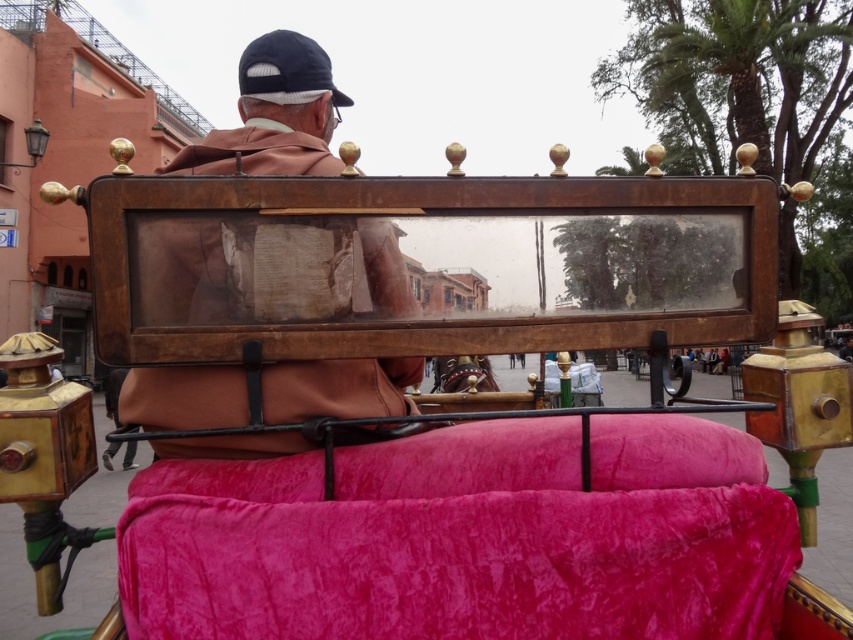
Who is taller, velvet pink blanket at center or brown leather jacket at upper center?

With more height is brown leather jacket at upper center.

Is velvet pink blanket at center taller than brown leather jacket at upper center?

Incorrect, velvet pink blanket at center's height is not larger of brown leather jacket at upper center's.

Between point (618, 480) and point (288, 173), which one is positioned behind?

Point (288, 173)

Identify the location of velvet pink blanket at center. (466, 538).